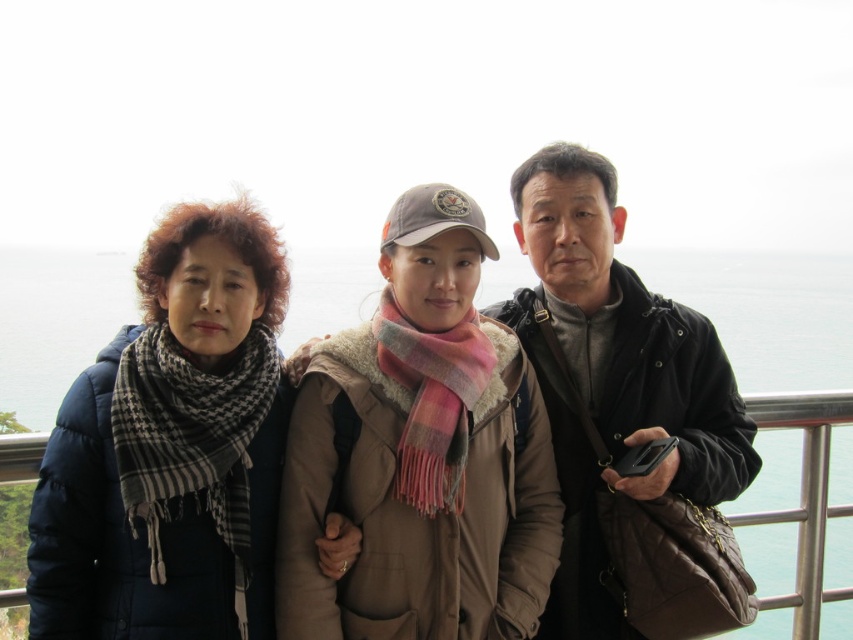
Question: Can you confirm if matte black jacket at center is positioned to the left of plaid scarf at center?

Choices:
 (A) yes
 (B) no

Answer: (A)

Question: Is matte black jacket at center below plaid scarf at left?

Choices:
 (A) no
 (B) yes

Answer: (A)

Question: Is matte black jacket at center below plaid scarf at center?

Choices:
 (A) yes
 (B) no

Answer: (A)

Question: Which of the following is the farthest from the observer?

Choices:
 (A) plaid scarf at center
 (B) matte black jacket at center
 (C) plaid scarf at left
 (D) matte black jacket at right

Answer: (A)

Question: Which object appears closest to the camera in this image?

Choices:
 (A) matte black jacket at right
 (B) plaid scarf at center
 (C) matte black jacket at center
 (D) plaid scarf at left

Answer: (D)

Question: Which point is farther to the camera?

Choices:
 (A) (184, 330)
 (B) (471, 465)

Answer: (B)